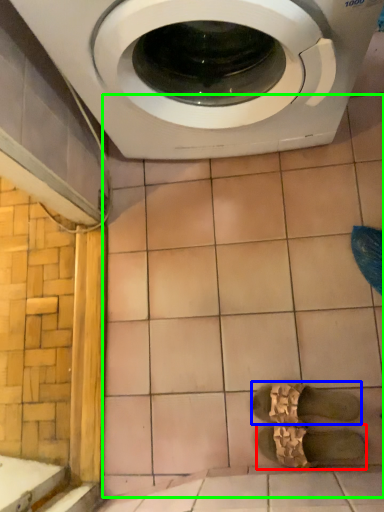
Question: Considering the real-world distances, which object is farthest from shoe (highlighted by a red box)? shoe (highlighted by a blue box) or ceramic tile (highlighted by a green box)?

Choices:
 (A) shoe
 (B) ceramic tile

Answer: (B)